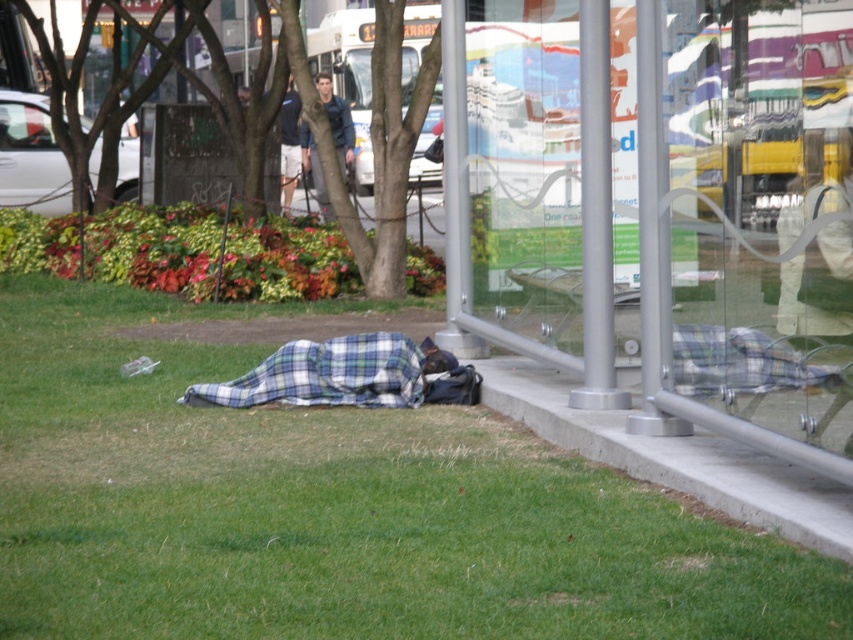
You are a photographer taking a picture of the urban scene. You notice the green grass at lower left and the plaid fabric blanket at lower center. Which object appears taller in the photo?

The green grass at lower left appears taller than the plaid fabric blanket at lower center in the photo.

You are standing at the origin point of the image. You want to walk to the green grass at lower left. Which direction should you go?

The green grass at lower left is located at point (334, 509), so you should move towards the lower left direction to reach it.